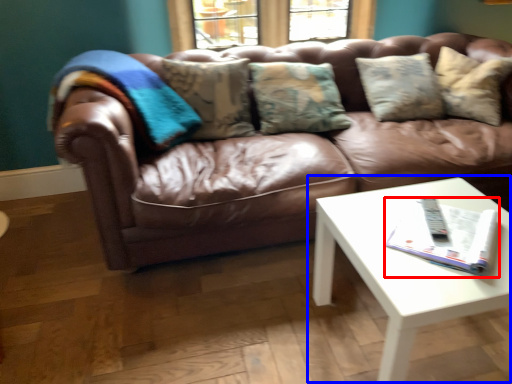
Question: Which object appears closest to the camera in this image, magazine (highlighted by a red box) or coffee table (highlighted by a blue box)?

Choices:
 (A) magazine
 (B) coffee table

Answer: (B)